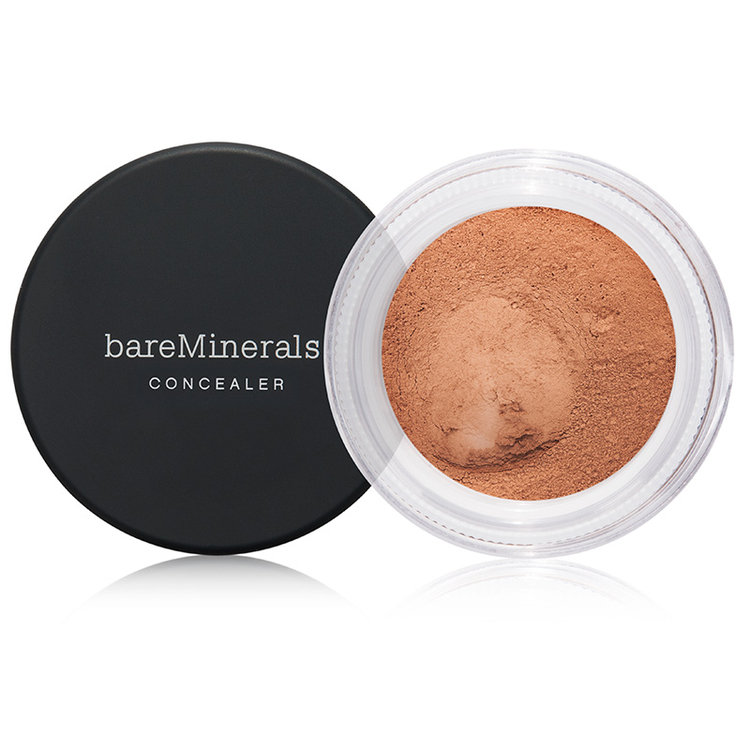
Locate an element on the screen. glass is located at coordinates (424, 488).